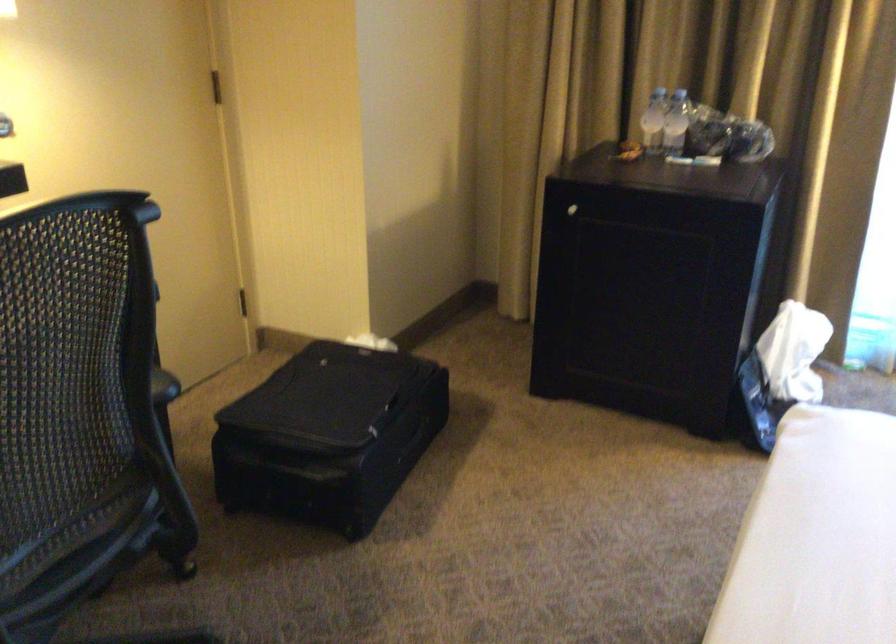
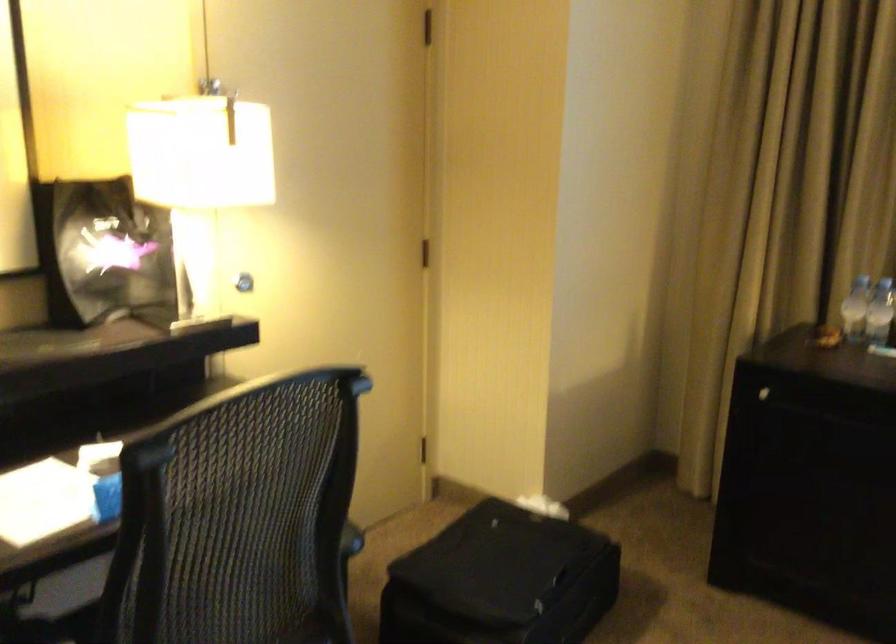
Question: The first image is from the beginning of the video and the second image is from the end. How did the camera likely rotate when shooting the video?

Choices:
 (A) Left
 (B) Right
 (C) Up
 (D) Down

Answer: (A)